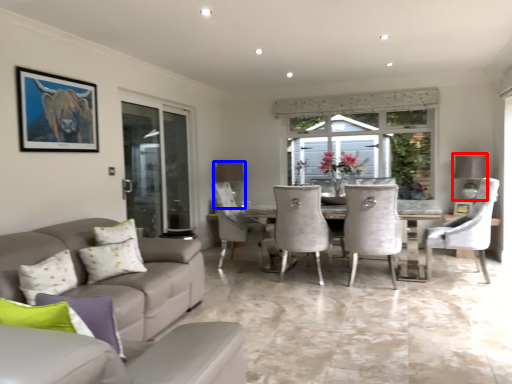
Question: Which point is closer to the camera, lamp (highlighted by a red box) or lamp (highlighted by a blue box)?

Choices:
 (A) lamp
 (B) lamp

Answer: (A)